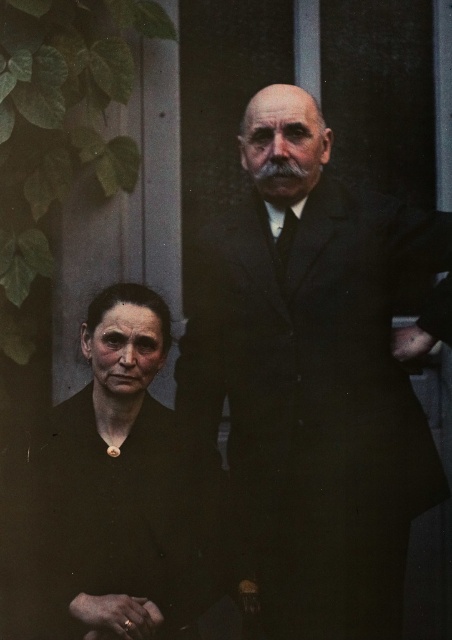
Question: Which of the following is the closest to the observer?

Choices:
 (A) dark brown suit at center
 (B) dark brown fabric at lower left

Answer: (B)

Question: Is dark brown suit at center to the right of dark brown fabric at lower left from the viewer's perspective?

Choices:
 (A) no
 (B) yes

Answer: (B)

Question: Can you confirm if dark brown suit at center is wider than dark brown fabric at lower left?

Choices:
 (A) yes
 (B) no

Answer: (A)

Question: Which point is closer to the camera taking this photo?

Choices:
 (A) (x=178, y=502)
 (B) (x=386, y=584)

Answer: (B)

Question: Where is dark brown suit at center located in relation to dark brown fabric at lower left in the image?

Choices:
 (A) above
 (B) below

Answer: (A)